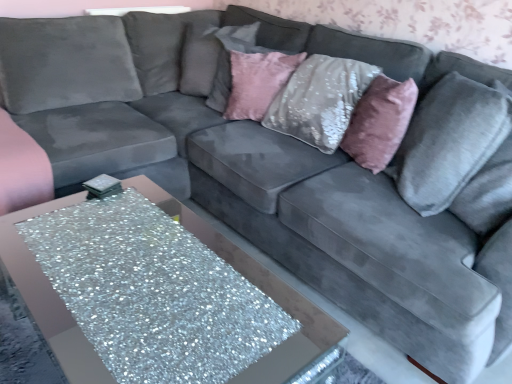
Question: Is velvet gray pillow at right, the first pillow positioned from the right, spatially inside pink plush throw pillow at upper right, or outside of it?

Choices:
 (A) inside
 (B) outside

Answer: (B)

Question: Looking at their shapes, would you say velvet gray pillow at right, which is the first pillow from front to back, is wider or thinner than pink plush throw pillow at upper right?

Choices:
 (A) wide
 (B) thin

Answer: (A)

Question: Based on their relative distances, which object is farther from the pink velvet pillow at upper center, which is counted as the 2th pillow, starting from the back?

Choices:
 (A) velvet gray pillow at right, marked as the third pillow in a left-to-right arrangement
 (B) glittery silver table at lower left
 (C) pink plush throw pillow at upper right
 (D) velvet gray pillow at upper center, placed as the 1th pillow when sorted from back to front

Answer: (B)

Question: Which object is the closest to the velvet gray pillow at upper center, the 1th pillow viewed from the left?

Choices:
 (A) velvet gray pillow at right, which is counted as the 3th pillow, starting from the back
 (B) pink velvet pillow at upper center, the 2th pillow positioned from the left
 (C) pink plush throw pillow at upper right
 (D) glittery silver table at lower left

Answer: (B)